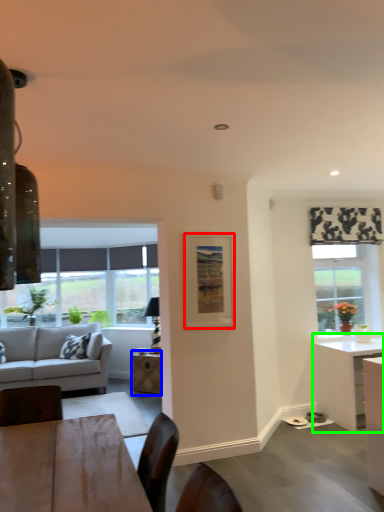
Question: Based on their relative distances, which object is nearer to picture frame (highlighted by a red box)? Choose from table (highlighted by a blue box) and desk (highlighted by a green box).

Choices:
 (A) table
 (B) desk

Answer: (B)